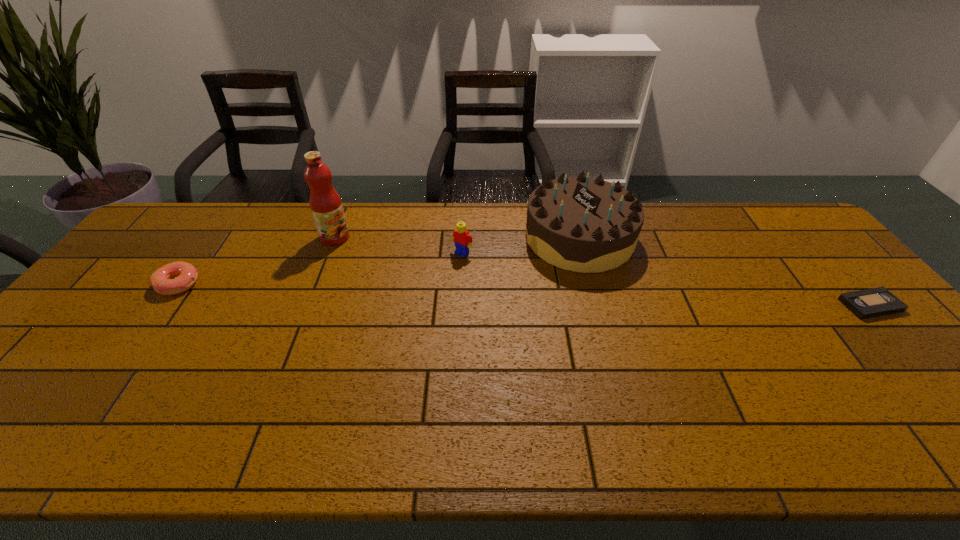
The width and height of the screenshot is (960, 540). Identify the location of vacant space located on the back of the doughnut. (237, 203).

What are the coordinates of `vacant space located on the back of the shortest object` in the screenshot? It's located at (817, 245).

Locate an element on the screen. vacant space located on the front label of the tallest object is located at coordinates click(419, 288).

Image resolution: width=960 pixels, height=540 pixels. What are the coordinates of `vacant region located 0.320m on the front label of the tallest object` in the screenshot? It's located at (416, 287).

Locate an element on the screen. This screenshot has width=960, height=540. vacant space located 0.130m on the front label of the tallest object is located at coordinates (372, 260).

Locate an element on the screen. The width and height of the screenshot is (960, 540). free spot located 0.130m on the front-facing side of the second object from right to left is located at coordinates (519, 286).

Identify the location of vacant space located on the front-facing side of the second object from right to left. This screenshot has width=960, height=540. click(x=473, y=322).

Where is `free spot located 0.230m on the front-facing side of the second object from right to left`? free spot located 0.230m on the front-facing side of the second object from right to left is located at coordinates pos(495,304).

You are a GUI agent. You are given a task and a screenshot of the screen. Output one action in this format:
    pyautogui.click(x=<x>, y=<y>)
    Task: Click on the blank space located 0.090m on the front-facing side of the Lego
    The image size is (960, 540).
    Given the screenshot: What is the action you would take?
    pyautogui.click(x=440, y=274)

Find the location of `vacant space situated 0.270m on the front-facing side of the Lego`. vacant space situated 0.270m on the front-facing side of the Lego is located at coordinates (401, 313).